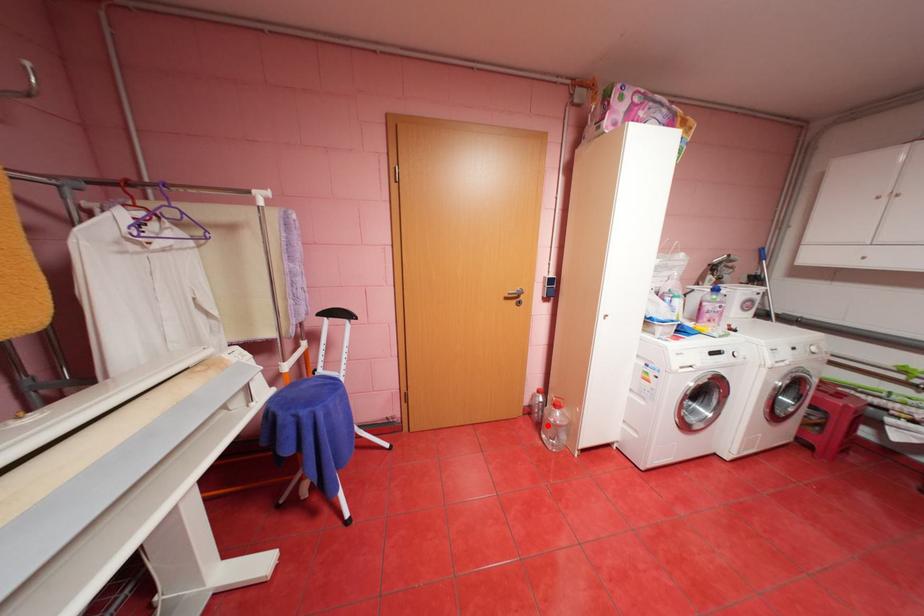
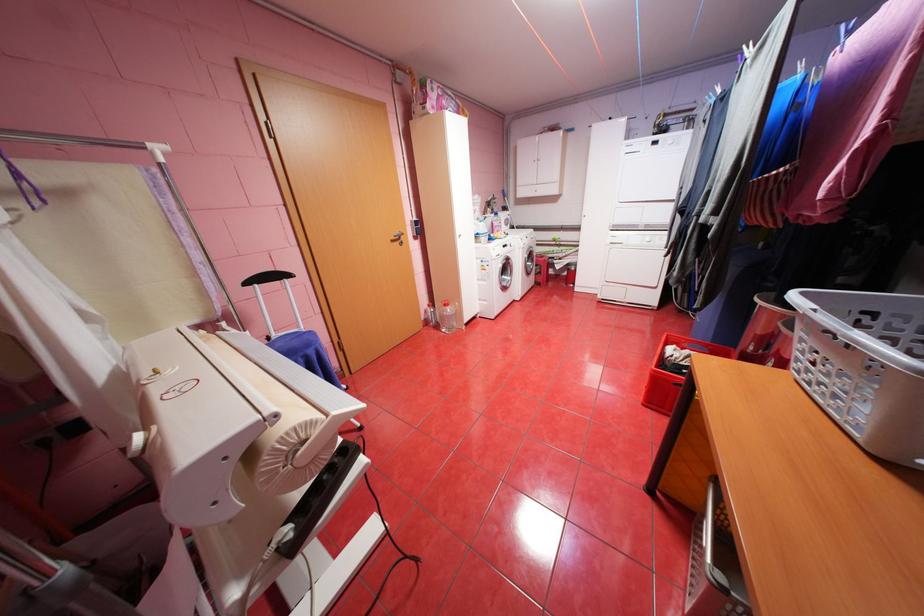
Find the pixel in the second image that matches the highlighted location in the first image.

(445, 326)